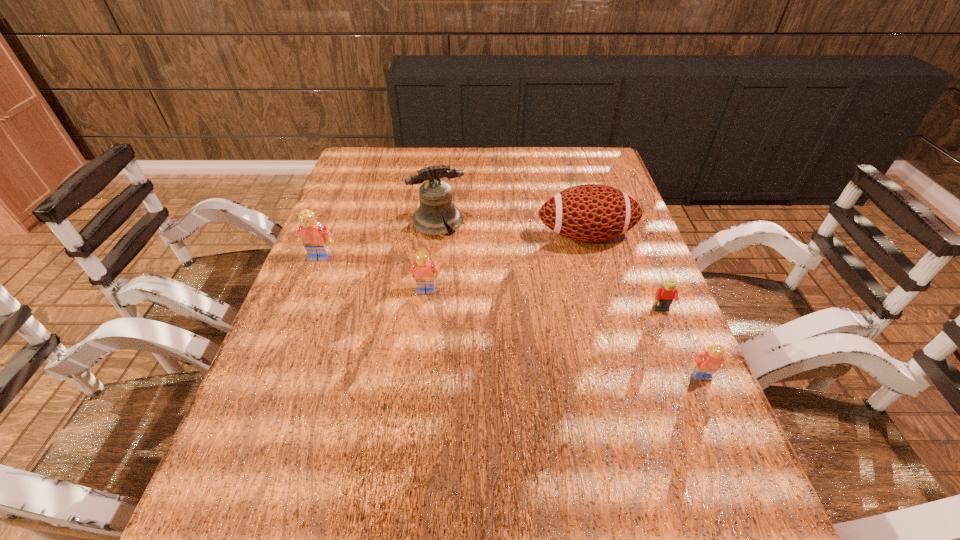
Please point a space for a new Lego to maintain equal intervals. Please provide its 2D coordinates. Your answer should be formatted as a tuple, i.e. [(x, y)], where the tuple contains the x and y coordinates of a point satisfying the conditions above.

[(552, 329)]